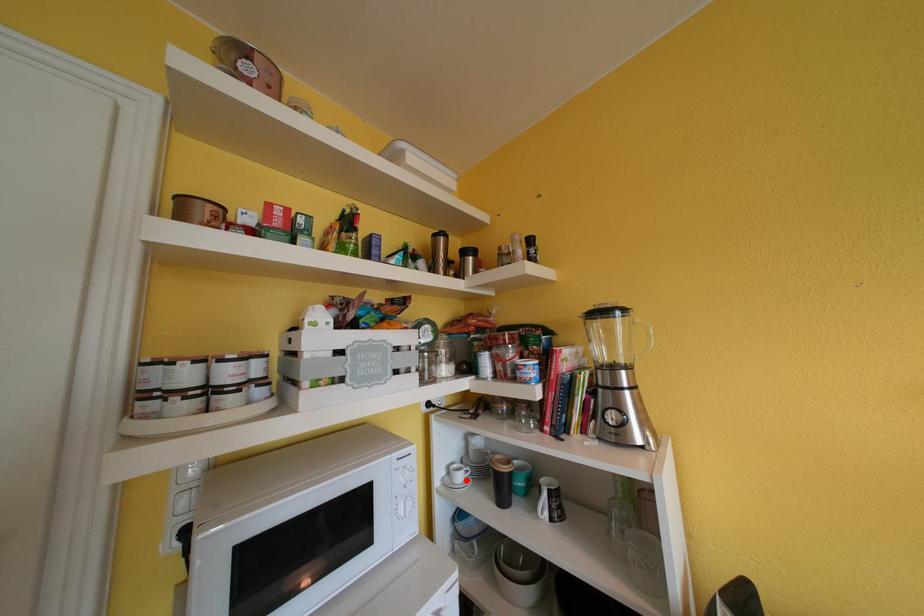
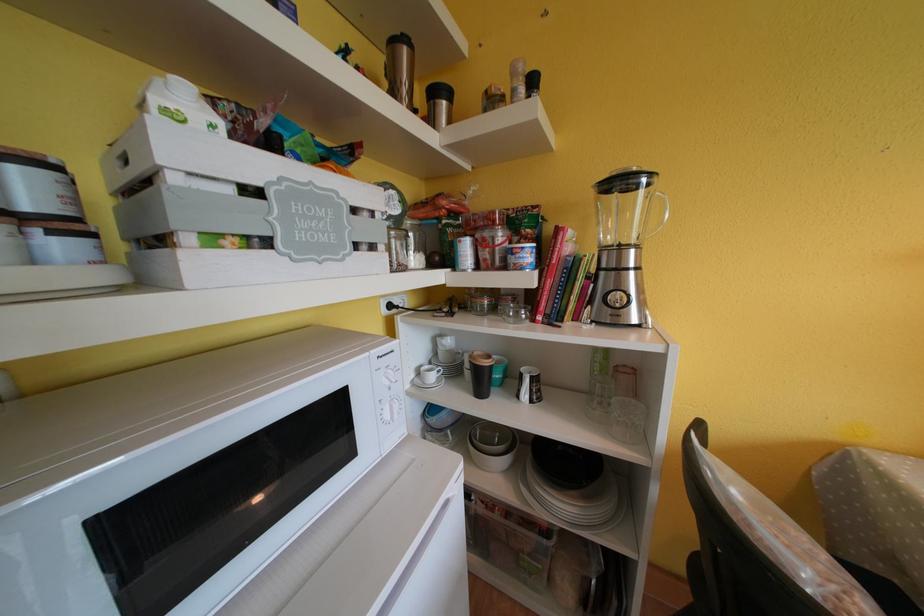
Locate, in the second image, the point that corresponds to the highlighted location in the first image.

(439, 381)